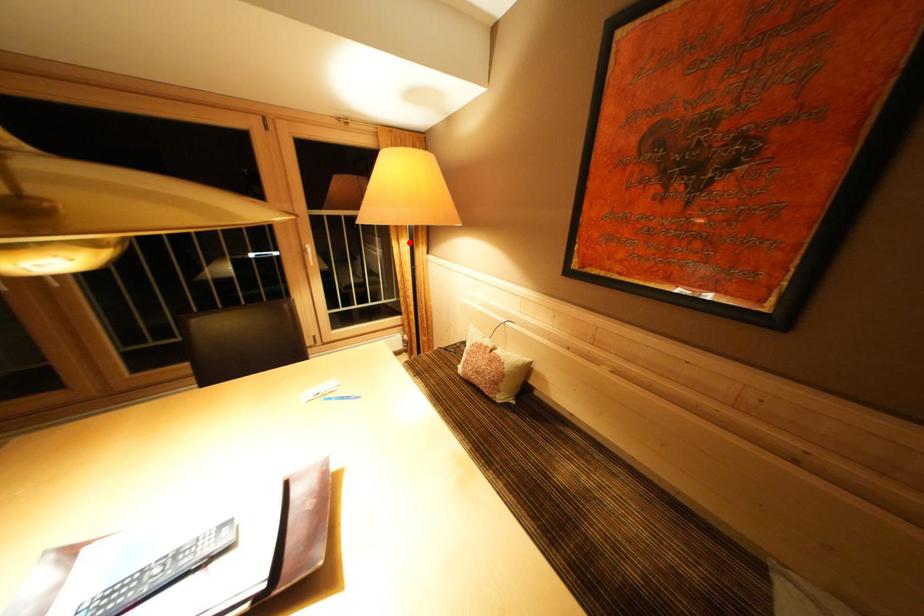
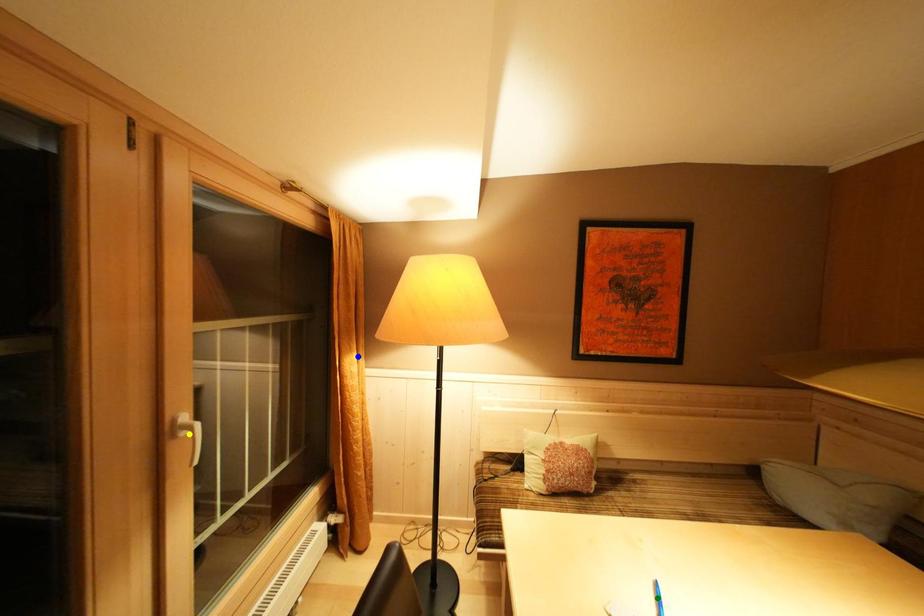
Question: I am providing you with two images of the same scene from different viewpoints. A red point is marked on the first image. You are given multiple points on the second image. Which spot in image 2 lines up with the point in image 1?

Choices:
 (A) green point
 (B) yellow point
 (C) blue point

Answer: (C)